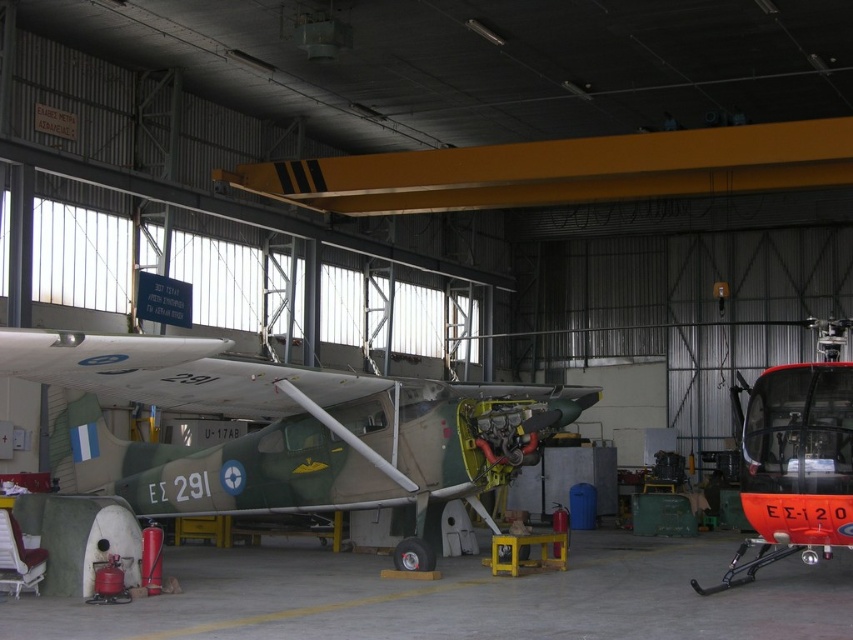
Question: Among these points, which one is farthest from the camera?

Choices:
 (A) (842, 472)
 (B) (317, 484)

Answer: (B)

Question: In this image, where is camouflage paint airplane at center located relative to orange glossy helicopter at right?

Choices:
 (A) right
 (B) left

Answer: (B)

Question: Which of the following is the farthest from the observer?

Choices:
 (A) (798, 477)
 (B) (329, 442)

Answer: (B)

Question: Among these points, which one is farthest from the camera?

Choices:
 (A) (828, 541)
 (B) (27, 364)

Answer: (A)

Question: Can you confirm if camouflage paint airplane at center is smaller than orange glossy helicopter at right?

Choices:
 (A) yes
 (B) no

Answer: (A)

Question: Is camouflage paint airplane at center below orange glossy helicopter at right?

Choices:
 (A) no
 (B) yes

Answer: (A)